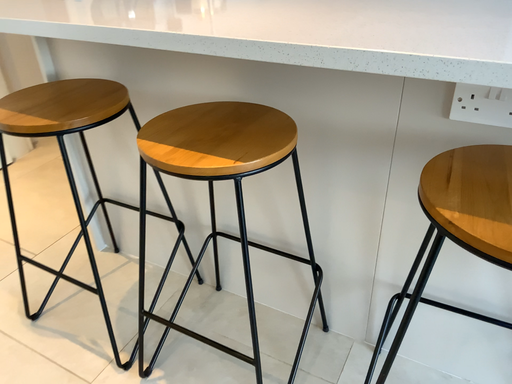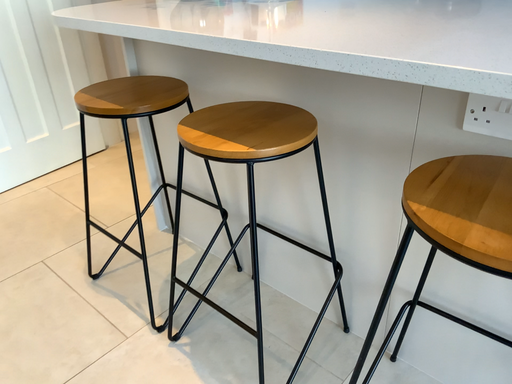
Question: How did the camera likely rotate when shooting the video?

Choices:
 (A) rotated left
 (B) rotated right

Answer: (A)